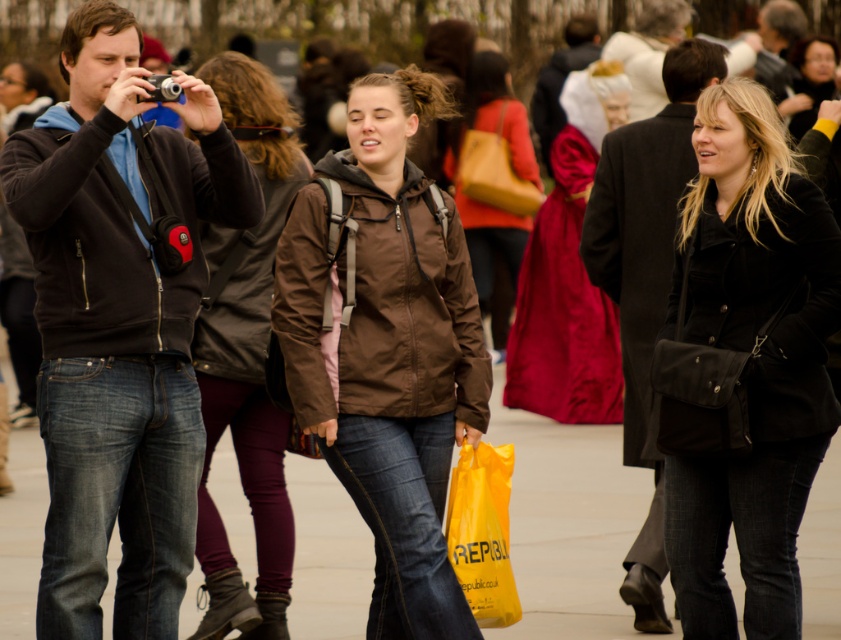
From the picture: You are a photographer trying to capture a clear shot of the silky red dress at center without the black leather coat at right blocking it. What should you do?

Move your camera position to the left so that the black leather coat at right is no longer in front of the silky red dress at center.

You are a photographer standing in the park and want to focus on the two points in the scene. Which point is closer to your camera lens, point (517, 196) or point (184, 100)?

Point (184, 100) is closer to the camera lens because the description states that point (517, 196) is further to the camera than point (184, 100).